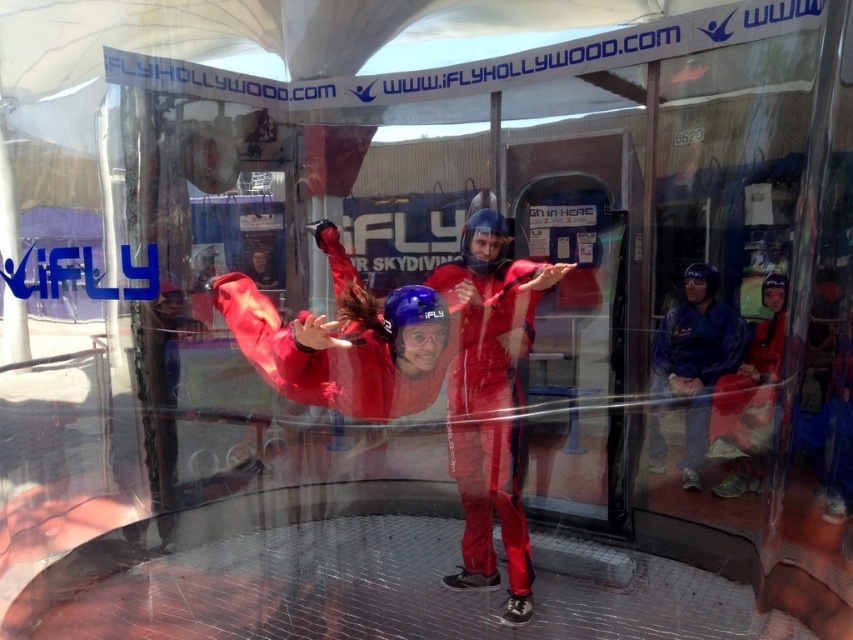
Is shiny red jumpsuit at center taller than matte blue helmet at upper right?

Yes, shiny red jumpsuit at center is taller than matte blue helmet at upper right.

Can you confirm if shiny red jumpsuit at center is wider than matte blue helmet at upper right?

Correct, the width of shiny red jumpsuit at center exceeds that of matte blue helmet at upper right.

This screenshot has width=853, height=640. Identify the location of shiny red jumpsuit at center. (489, 413).

Between matte red jumpsuit at center and shiny red jumpsuit at center, which one has more height?

With more height is shiny red jumpsuit at center.

Is matte red jumpsuit at center below shiny red jumpsuit at center?

Incorrect, matte red jumpsuit at center is not positioned below shiny red jumpsuit at center.

Is point (263, 332) in front of point (473, 509)?

That is True.

Locate an element on the screen. The width and height of the screenshot is (853, 640). matte red jumpsuit at center is located at coordinates (346, 340).

Which is more to the left, shiny red jumpsuit at center or blue fabric jacket at right?

Positioned to the left is shiny red jumpsuit at center.

Is shiny red jumpsuit at center to the right of blue fabric jacket at right from the viewer's perspective?

No, shiny red jumpsuit at center is not to the right of blue fabric jacket at right.

Between point (496, 268) and point (680, 396), which one is positioned in front?

Point (496, 268)

At what (x,y) coordinates should I click in order to perform the action: click on shiny red jumpsuit at center. Please return your answer as a coordinate pair (x, y). Looking at the image, I should click on (489, 413).